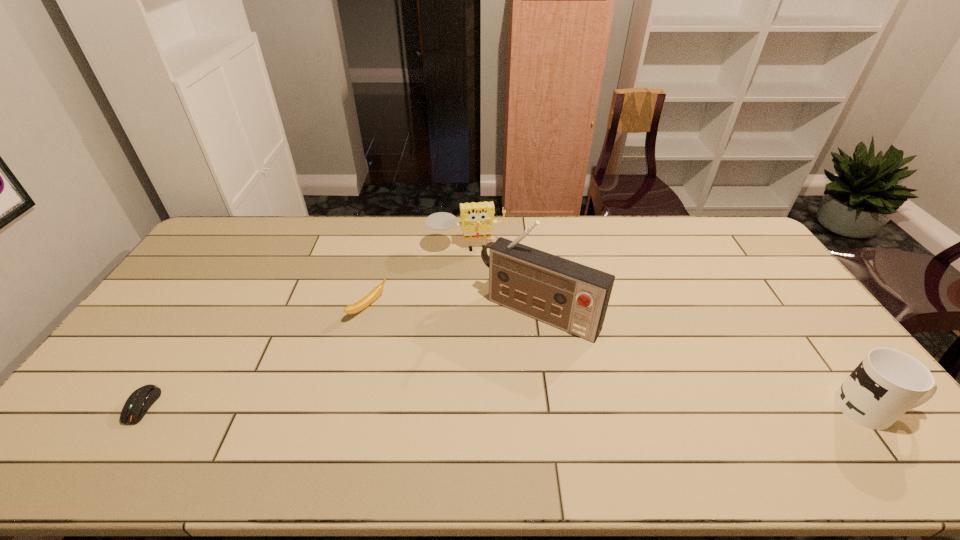
I want to click on the shortest object, so click(139, 402).

You are a GUI agent. You are given a task and a screenshot of the screen. Output one action in this format:
    pyautogui.click(x=<x>, y=<y>)
    Task: Click on the computer equipment
    
    Given the screenshot: What is the action you would take?
    pyautogui.click(x=139, y=402)

Where is `mug`? The width and height of the screenshot is (960, 540). mug is located at coordinates (887, 383).

The width and height of the screenshot is (960, 540). I want to click on the fourth object from right to left, so click(x=374, y=294).

Find the location of a particular element. The image size is (960, 540). the second shortest object is located at coordinates (374, 294).

Locate an element on the screen. the farthest object is located at coordinates (477, 219).

At what (x,y) coordinates should I click in order to perform the action: click on radio receiver. Please return your answer as a coordinate pair (x, y). This screenshot has width=960, height=540. Looking at the image, I should click on (573, 297).

Identify the location of vacant area situated 0.370m at the stem of the banana. The image size is (960, 540). (484, 367).

The height and width of the screenshot is (540, 960). What are the coordinates of `vacant space located at the stem of the banana` in the screenshot? It's located at (444, 348).

Identify the location of vacant space located 0.140m at the stem of the banana. Image resolution: width=960 pixels, height=540 pixels. pos(417,334).